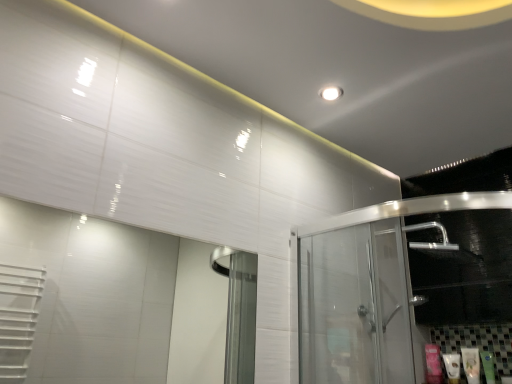
In order to face transparent glass door at right, should I rotate leftwards or rightwards?

Turn right by 20.569 degrees to look at transparent glass door at right.

Where is `white glossy lotion at lower right, which ranks as the 2th toiletry in right-to-left order`? white glossy lotion at lower right, which ranks as the 2th toiletry in right-to-left order is located at coordinates (471, 364).

In order to click on white glossy lotion at lower right, marked as the third toiletry in a right-to-left arrangement in this screenshot , I will do `click(452, 367)`.

Where is `transparent glass door at right`? The image size is (512, 384). transparent glass door at right is located at coordinates (365, 290).

Looking at their sizes, would you say pink matte tube at lower right, acting as the first toiletry starting from the left, is wider or thinner than green matte tube at lower right, acting as the first toiletry starting from the right?

Considering their sizes, pink matte tube at lower right, acting as the first toiletry starting from the left, looks slimmer than green matte tube at lower right, acting as the first toiletry starting from the right.

How much distance is there between pink matte tube at lower right, the fourth toiletry viewed from the right, and green matte tube at lower right, which ranks as the 4th toiletry in left-to-right order?

20.80 centimeters.

Considering the positions of objects pink matte tube at lower right, the fourth toiletry viewed from the right, and green matte tube at lower right, acting as the first toiletry starting from the right, in the image provided, who is more to the left, pink matte tube at lower right, the fourth toiletry viewed from the right, or green matte tube at lower right, acting as the first toiletry starting from the right,?

From the viewer's perspective, pink matte tube at lower right, the fourth toiletry viewed from the right, appears more on the left side.

From the picture: Which is more distant, (490, 361) or (474, 351)?

Positioned behind is point (474, 351).

From a real-world perspective, is green matte tube at lower right, which ranks as the 4th toiletry in left-to-right order, above or below white glossy lotion at lower right, which is counted as the third toiletry, starting from the left?

green matte tube at lower right, which ranks as the 4th toiletry in left-to-right order, is below white glossy lotion at lower right, which is counted as the third toiletry, starting from the left.

What's the angular difference between green matte tube at lower right, which ranks as the 4th toiletry in left-to-right order, and white glossy lotion at lower right, which ranks as the 2th toiletry in right-to-left order,'s facing directions?

There is a 0.00311-degree angle between the facing directions of green matte tube at lower right, which ranks as the 4th toiletry in left-to-right order, and white glossy lotion at lower right, which ranks as the 2th toiletry in right-to-left order.

Relative to white glossy lotion at lower right, which ranks as the 2th toiletry in right-to-left order, is green matte tube at lower right, acting as the first toiletry starting from the right, in front or behind?

In the image, green matte tube at lower right, acting as the first toiletry starting from the right, appears in front of white glossy lotion at lower right, which ranks as the 2th toiletry in right-to-left order.

What's the angular difference between white glossy lotion at lower right, which ranks as the 2th toiletry in right-to-left order, and pink matte tube at lower right, the fourth toiletry viewed from the right,'s facing directions?

The angle between the facing direction of white glossy lotion at lower right, which ranks as the 2th toiletry in right-to-left order, and the facing direction of pink matte tube at lower right, the fourth toiletry viewed from the right, is 0.00683 degrees.

Is white glossy lotion at lower right, which ranks as the 2th toiletry in right-to-left order, inside the boundaries of pink matte tube at lower right, the fourth toiletry viewed from the right, or outside?

The correct answer is: outside.

Which toiletry is the 2nd one when counting from the right side of the pink matte tube at lower right, the fourth toiletry viewed from the right? Please provide its 2D coordinates.

[(471, 364)]

From the image's perspective, is white glossy lotion at lower right, which ranks as the 2th toiletry in right-to-left order, on top of pink matte tube at lower right, the fourth toiletry viewed from the right?

Yes, from the image's perspective, white glossy lotion at lower right, which ranks as the 2th toiletry in right-to-left order, is above pink matte tube at lower right, the fourth toiletry viewed from the right.

Is white glossy lotion at lower right, marked as the third toiletry in a right-to-left arrangement, looking in the opposite direction of pink matte tube at lower right, the fourth toiletry viewed from the right?

white glossy lotion at lower right, marked as the third toiletry in a right-to-left arrangement, is not turned away from pink matte tube at lower right, the fourth toiletry viewed from the right.

Is white glossy lotion at lower right, which ranks as the 2th toiletry in left-to-right order, with pink matte tube at lower right, acting as the first toiletry starting from the left?

Yes, white glossy lotion at lower right, which ranks as the 2th toiletry in left-to-right order, and pink matte tube at lower right, acting as the first toiletry starting from the left, clearly make contact.

Considering the sizes of white glossy lotion at lower right, which ranks as the 2th toiletry in left-to-right order, and pink matte tube at lower right, the fourth toiletry viewed from the right, in the image, is white glossy lotion at lower right, which ranks as the 2th toiletry in left-to-right order, bigger or smaller than pink matte tube at lower right, the fourth toiletry viewed from the right,?

In the image, white glossy lotion at lower right, which ranks as the 2th toiletry in left-to-right order, appears to be smaller than pink matte tube at lower right, the fourth toiletry viewed from the right.

From the image's perspective, between transparent glass door at right and white glossy lotion at lower right, which ranks as the 2th toiletry in left-to-right order, which one is located above?

From the image's view, transparent glass door at right is above.

Is transparent glass door at right turned away from white glossy lotion at lower right, which ranks as the 2th toiletry in left-to-right order?

No.

Which is in front, transparent glass door at right or white glossy lotion at lower right, marked as the third toiletry in a right-to-left arrangement?

transparent glass door at right is more forward.

Based on their sizes in the image, would you say white glossy lotion at lower right, which ranks as the 2th toiletry in right-to-left order, is bigger or smaller than green matte tube at lower right, which ranks as the 4th toiletry in left-to-right order?

In the image, white glossy lotion at lower right, which ranks as the 2th toiletry in right-to-left order, appears to be larger than green matte tube at lower right, which ranks as the 4th toiletry in left-to-right order.

Considering the relative sizes of white glossy lotion at lower right, which is counted as the third toiletry, starting from the left, and green matte tube at lower right, which ranks as the 4th toiletry in left-to-right order, in the image provided, is white glossy lotion at lower right, which is counted as the third toiletry, starting from the left, shorter than green matte tube at lower right, which ranks as the 4th toiletry in left-to-right order,?

No.

From a real-world perspective, is white glossy lotion at lower right, which ranks as the 2th toiletry in right-to-left order, positioned above or below green matte tube at lower right, acting as the first toiletry starting from the right?

Clearly, from a real-world perspective, white glossy lotion at lower right, which ranks as the 2th toiletry in right-to-left order, is above green matte tube at lower right, acting as the first toiletry starting from the right.

The image size is (512, 384). Identify the location of toiletry that is the 3rd one when counting downward from the green matte tube at lower right, which ranks as the 4th toiletry in left-to-right order (from the image's perspective). (433, 364).

Does green matte tube at lower right, which ranks as the 4th toiletry in left-to-right order, turn towards pink matte tube at lower right, the fourth toiletry viewed from the right?

No.

From the picture: From a real-world perspective, relative to pink matte tube at lower right, the fourth toiletry viewed from the right, is green matte tube at lower right, which ranks as the 4th toiletry in left-to-right order, vertically above or below?

green matte tube at lower right, which ranks as the 4th toiletry in left-to-right order, is below pink matte tube at lower right, the fourth toiletry viewed from the right.

Consider the image. Is green matte tube at lower right, acting as the first toiletry starting from the right, inside or outside of pink matte tube at lower right, the fourth toiletry viewed from the right?

green matte tube at lower right, acting as the first toiletry starting from the right, lies outside pink matte tube at lower right, the fourth toiletry viewed from the right.

From a real-world perspective, count 2nd toiletrys upward from the green matte tube at lower right, acting as the first toiletry starting from the right, and point to it. Please provide its 2D coordinates.

[(433, 364)]

At what (x,y) coordinates should I click in order to perform the action: click on toiletry that is the 1st object located behind the green matte tube at lower right, acting as the first toiletry starting from the right. Please return your answer as a coordinate pair (x, y). Looking at the image, I should click on (471, 364).

When comparing their distances from transparent glass door at right, does green matte tube at lower right, acting as the first toiletry starting from the right, or white glossy lotion at lower right, marked as the third toiletry in a right-to-left arrangement, seem closer?

white glossy lotion at lower right, marked as the third toiletry in a right-to-left arrangement, is positioned closer to the anchor transparent glass door at right.

From the image, which object appears to be farther from white glossy lotion at lower right, which is counted as the third toiletry, starting from the left, pink matte tube at lower right, the fourth toiletry viewed from the right, or green matte tube at lower right, which ranks as the 4th toiletry in left-to-right order?

pink matte tube at lower right, the fourth toiletry viewed from the right.

When comparing their distances from transparent glass door at right, does white glossy lotion at lower right, marked as the third toiletry in a right-to-left arrangement, or green matte tube at lower right, which ranks as the 4th toiletry in left-to-right order, seem further?

green matte tube at lower right, which ranks as the 4th toiletry in left-to-right order, is positioned further to the anchor transparent glass door at right.

When comparing their distances from pink matte tube at lower right, the fourth toiletry viewed from the right, does white glossy lotion at lower right, marked as the third toiletry in a right-to-left arrangement, or white glossy lotion at lower right, which ranks as the 2th toiletry in right-to-left order, seem further?

white glossy lotion at lower right, which ranks as the 2th toiletry in right-to-left order, lies further to pink matte tube at lower right, the fourth toiletry viewed from the right, than the other object.

Based on their spatial positions, is transparent glass door at right or green matte tube at lower right, acting as the first toiletry starting from the right, closer to white glossy lotion at lower right, which ranks as the 2th toiletry in left-to-right order?

green matte tube at lower right, acting as the first toiletry starting from the right, lies closer to white glossy lotion at lower right, which ranks as the 2th toiletry in left-to-right order, than the other object.

Looking at the image, which one is located further to green matte tube at lower right, which ranks as the 4th toiletry in left-to-right order, white glossy lotion at lower right, which is counted as the third toiletry, starting from the left, or white glossy lotion at lower right, which ranks as the 2th toiletry in left-to-right order?

white glossy lotion at lower right, which ranks as the 2th toiletry in left-to-right order, is positioned further to the anchor green matte tube at lower right, which ranks as the 4th toiletry in left-to-right order.

When comparing their distances from green matte tube at lower right, which ranks as the 4th toiletry in left-to-right order, does pink matte tube at lower right, acting as the first toiletry starting from the left, or transparent glass door at right seem closer?

pink matte tube at lower right, acting as the first toiletry starting from the left, is positioned closer to the anchor green matte tube at lower right, which ranks as the 4th toiletry in left-to-right order.

Based on their spatial positions, is white glossy lotion at lower right, which is counted as the third toiletry, starting from the left, or pink matte tube at lower right, the fourth toiletry viewed from the right, closer to white glossy lotion at lower right, marked as the third toiletry in a right-to-left arrangement?

pink matte tube at lower right, the fourth toiletry viewed from the right, lies closer to white glossy lotion at lower right, marked as the third toiletry in a right-to-left arrangement, than the other object.

Where is `toiletry between transparent glass door at right and white glossy lotion at lower right, which is counted as the third toiletry, starting from the left, from front to back`? toiletry between transparent glass door at right and white glossy lotion at lower right, which is counted as the third toiletry, starting from the left, from front to back is located at coordinates (488, 366).

This screenshot has height=384, width=512. What are the coordinates of `toiletry situated between white glossy lotion at lower right, which ranks as the 2th toiletry in left-to-right order, and green matte tube at lower right, which ranks as the 4th toiletry in left-to-right order, from left to right` in the screenshot? It's located at (471, 364).

Image resolution: width=512 pixels, height=384 pixels. In order to click on toiletry between pink matte tube at lower right, the fourth toiletry viewed from the right, and white glossy lotion at lower right, which ranks as the 2th toiletry in right-to-left order in this screenshot , I will do `click(452, 367)`.